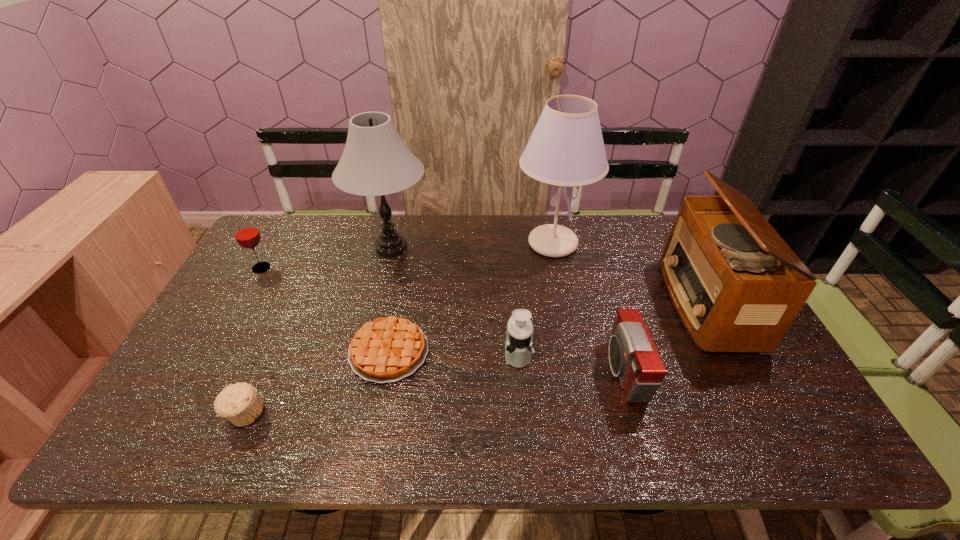
You are a GUI agent. You are given a task and a screenshot of the screen. Output one action in this format:
    pyautogui.click(x=<x>, y=<y>)
    Task: Click on the vacant space located on the left of the second shortest object
    
    Given the screenshot: What is the action you would take?
    pyautogui.click(x=191, y=414)

Identify the location of vacant space situated 0.110m on the back of the pie. (400, 294).

The height and width of the screenshot is (540, 960). I want to click on lampshade at the far edge, so click(x=566, y=148).

The height and width of the screenshot is (540, 960). Identify the location of lamp that is positioned at the far edge. (375, 162).

Find the location of a particular element. Image resolution: width=960 pixels, height=540 pixels. object that is at the near edge is located at coordinates (241, 403).

At what (x,y) coordinates should I click in order to perform the action: click on object situated at the left edge. Please return your answer as a coordinate pair (x, y). Looking at the image, I should click on (247, 235).

Where is `object located in the right edge section of the desktop`? This screenshot has height=540, width=960. object located in the right edge section of the desktop is located at coordinates (727, 271).

Find the location of a particular element. The image size is (960, 540). free space at the far edge is located at coordinates (309, 247).

In the image, there is a desktop. In order to click on vacant space at the near edge in this screenshot , I will do `click(234, 428)`.

Find the location of `vacant area at the left edge of the desktop`. vacant area at the left edge of the desktop is located at coordinates (203, 397).